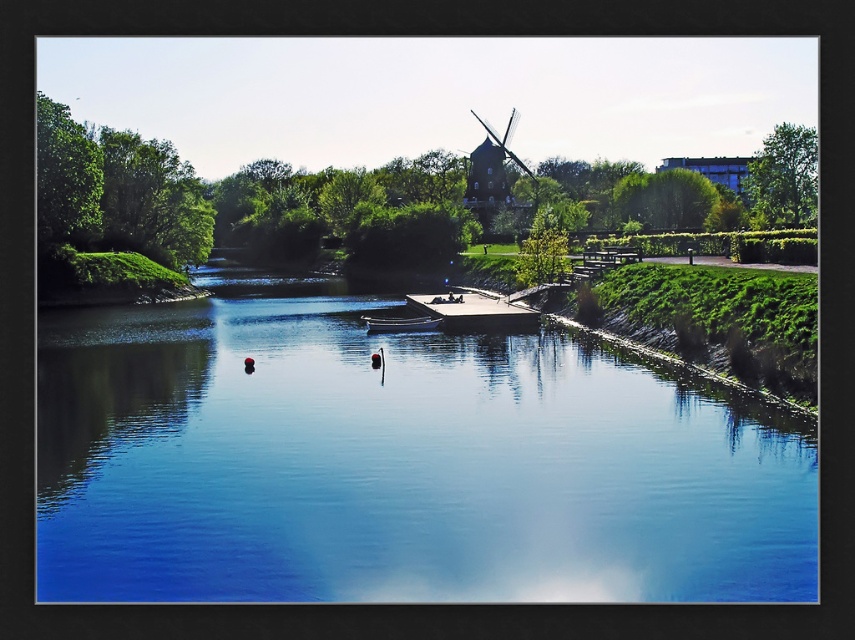
Question: In this image, where is blue smooth water at center located relative to blue glossy boat at center?

Choices:
 (A) left
 (B) right

Answer: (A)

Question: Which point appears closest to the camera in this image?

Choices:
 (A) (124, 355)
 (B) (433, 317)

Answer: (A)

Question: Can you confirm if blue smooth water at center is wider than blue glossy boat at center?

Choices:
 (A) yes
 (B) no

Answer: (A)

Question: Which object appears farthest from the camera in this image?

Choices:
 (A) blue glossy boat at center
 (B) blue smooth water at center

Answer: (A)

Question: Does blue smooth water at center appear on the right side of blue glossy boat at center?

Choices:
 (A) yes
 (B) no

Answer: (B)